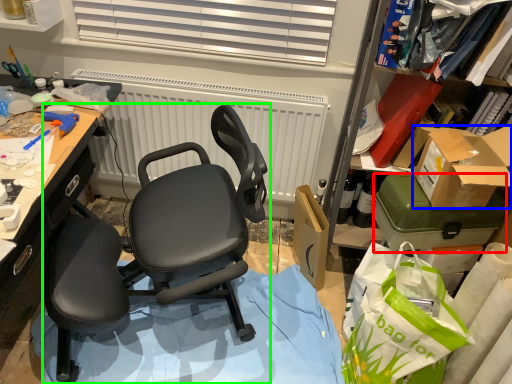
Question: Which object is positioned farthest from box (highlighted by a red box)? Select from box (highlighted by a blue box) and chair (highlighted by a green box).

Choices:
 (A) box
 (B) chair

Answer: (B)